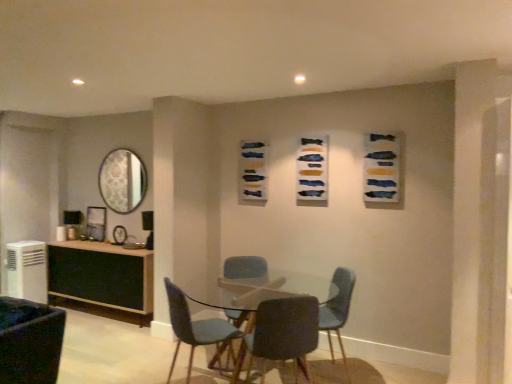
This screenshot has width=512, height=384. Describe the element at coordinates (253, 171) in the screenshot. I see `textured fabric artwork at center, which is counted as the 1th art, starting from the left` at that location.

What do you see at coordinates (122, 181) in the screenshot? Image resolution: width=512 pixels, height=384 pixels. I see `silver/metallic mirror at upper left` at bounding box center [122, 181].

This screenshot has width=512, height=384. What do you see at coordinates (27, 271) in the screenshot?
I see `white plastic air conditioner at lower left` at bounding box center [27, 271].

This screenshot has height=384, width=512. What do you see at coordinates (382, 168) in the screenshot?
I see `blue textured fabric at upper right, the first art when ordered from right to left` at bounding box center [382, 168].

Locate an element on the screen. matte gray chair at center, the 2th chair from the left is located at coordinates (196, 329).

Describe the element at coordinates (102, 277) in the screenshot. I see `matte wood desk at left` at that location.

The image size is (512, 384). I want to click on textured fabric artwork at center, which is counted as the 1th art, starting from the left, so click(253, 171).

Is matte yellow and blue abstract painting at center, the 2th art in the front-to-back sequence, not close to white plastic air conditioner at lower left?

matte yellow and blue abstract painting at center, the 2th art in the front-to-back sequence, is positioned a significant distance from white plastic air conditioner at lower left.

Between matte yellow and blue abstract painting at center, the 2th art positioned from the right, and white plastic air conditioner at lower left, which one has smaller width?

matte yellow and blue abstract painting at center, the 2th art positioned from the right.

Which of these two, matte yellow and blue abstract painting at center, the 2th art positioned from the right, or white plastic air conditioner at lower left, stands shorter?

With less height is matte yellow and blue abstract painting at center, the 2th art positioned from the right.

There is a matte wood desk at left. Identify the location of the 4th chair below it (from the image's perspective). The width and height of the screenshot is (512, 384). (282, 333).

Is matte wood desk at left inside or outside of velvet blue chair at center, placed as the fourth chair when sorted from left to right?

The correct answer is: outside.

Is point (71, 241) farther from viewer compared to point (275, 359)?

Yes.

Could you tell me if matte wood desk at left is facing velvet blue chair at center, placed as the fourth chair when sorted from left to right?

No, matte wood desk at left does not turn towards velvet blue chair at center, placed as the fourth chair when sorted from left to right.

Which of these two, white plastic air conditioner at lower left or clear glass table at center, is thinner?

white plastic air conditioner at lower left.

Considering the sizes of objects white plastic air conditioner at lower left and clear glass table at center in the image provided, who is smaller, white plastic air conditioner at lower left or clear glass table at center?

Smaller between the two is white plastic air conditioner at lower left.

From the image's perspective, which one is positioned higher, white plastic air conditioner at lower left or clear glass table at center?

white plastic air conditioner at lower left appears higher in the image.

How many degrees apart are the facing directions of clear glass table at center and blue textured fabric at upper right, the first art when ordered from right to left?

The angle between the facing direction of clear glass table at center and the facing direction of blue textured fabric at upper right, the first art when ordered from right to left, is 0.559 degrees.

In the scene shown: Considering the positions of objects clear glass table at center and blue textured fabric at upper right, which is the first art in front-to-back order, in the image provided, who is more to the right, clear glass table at center or blue textured fabric at upper right, which is the first art in front-to-back order,?

From the viewer's perspective, blue textured fabric at upper right, which is the first art in front-to-back order, appears more on the right side.

Locate an element on the screen. kitchen & dining room table on the left of blue textured fabric at upper right, which appears as the 3th art when viewed from the left is located at coordinates (282, 297).

In the scene shown: Would you say clear glass table at center is inside or outside blue textured fabric at upper right, which appears as the 3th art when viewed from the left?

clear glass table at center exists outside the volume of blue textured fabric at upper right, which appears as the 3th art when viewed from the left.

Looking at this image, is matte yellow and blue abstract painting at center, the 2th art positioned from the right, smaller than clear glass table at center?

Correct, matte yellow and blue abstract painting at center, the 2th art positioned from the right, occupies less space than clear glass table at center.

From the image's perspective, is matte yellow and blue abstract painting at center, the 2th art positioned from the right, under clear glass table at center?

No.

Is matte yellow and blue abstract painting at center, the second art in the left-to-right sequence, completely or partially outside of clear glass table at center?

Indeed, matte yellow and blue abstract painting at center, the second art in the left-to-right sequence, is completely outside clear glass table at center.

Consider the image. Can you tell me how much matte yellow and blue abstract painting at center, the 2th art in the front-to-back sequence, and clear glass table at center differ in facing direction?

The facing directions of matte yellow and blue abstract painting at center, the 2th art in the front-to-back sequence, and clear glass table at center are 0.549 degrees apart.

Between matte blue chair at center, the third chair from the left, and clear glass table at center, which one has larger size?

clear glass table at center is bigger.

Is matte blue chair at center, the third chair from the left, situated inside clear glass table at center or outside?

matte blue chair at center, the third chair from the left, exists entirely within clear glass table at center.

Consider the image. Does matte blue chair at center, the third chair from the left, have a greater height compared to clear glass table at center?

Indeed, matte blue chair at center, the third chair from the left, has a greater height compared to clear glass table at center.

How far apart are clear glass table at center and velvet blue chair at center, which is counted as the 2th chair, starting from the right?

The distance of clear glass table at center from velvet blue chair at center, which is counted as the 2th chair, starting from the right, is 82.00 centimeters.

Does clear glass table at center have a lesser height compared to velvet blue chair at center, which is counted as the 2th chair, starting from the right?

Correct, clear glass table at center is not as tall as velvet blue chair at center, which is counted as the 2th chair, starting from the right.

How different are the orientations of clear glass table at center and velvet blue chair at center, placed as the fourth chair when sorted from left to right, in degrees?

They differ by 141 degrees in their facing directions.

From a real-world perspective, is clear glass table at center physically below velvet blue chair at center, placed as the fourth chair when sorted from left to right?

Yes, from a real-world perspective, clear glass table at center is below velvet blue chair at center, placed as the fourth chair when sorted from left to right.

Identify the location of appliance behind the matte yellow and blue abstract painting at center, marked as the second art in a back-to-front arrangement. (27, 271).

Where is `the 4th chair in front of the matte wood desk at left`? the 4th chair in front of the matte wood desk at left is located at coordinates (282, 333).

From the image, which object appears to be farther from matte gray chair at center, placed as the fourth chair when sorted from right to left, matte wood desk at left or textured fabric artwork at center, which is counted as the 1th art, starting from the left?

matte wood desk at left lies further to matte gray chair at center, placed as the fourth chair when sorted from right to left, than the other object.

Looking at the image, which one is located further to velvet blue chair at center, which is counted as the 2th chair, starting from the right, matte gray chair at center, placed as the fourth chair when sorted from right to left, or clear glass table at center?

Among the two, clear glass table at center is located further to velvet blue chair at center, which is counted as the 2th chair, starting from the right.

Which object lies further to the anchor point silver/metallic mirror at upper left, velvet blue chair at center, which is counted as the 2th chair, starting from the right, or velvet dark blue chair at lower left, acting as the first chair starting from the left?

velvet blue chair at center, which is counted as the 2th chair, starting from the right, lies further to silver/metallic mirror at upper left than the other object.

When comparing their distances from matte blue chair at center, the third chair from the left, does matte wood desk at left or textured fabric artwork at center, which is counted as the 1th art, starting from the left, seem closer?

textured fabric artwork at center, which is counted as the 1th art, starting from the left.

Which object lies further to the anchor point silver/metallic mirror at upper left, matte wood desk at left or matte gray chair at center, placed as the fourth chair when sorted from right to left?

matte gray chair at center, placed as the fourth chair when sorted from right to left, is positioned further to the anchor silver/metallic mirror at upper left.

From the picture: When comparing their distances from matte gray chair at center, placed as the fourth chair when sorted from right to left, does matte yellow and blue abstract painting at center, the 2th art in the front-to-back sequence, or textured fabric artwork at center, which is counted as the 1th art, starting from the left, seem further?

matte yellow and blue abstract painting at center, the 2th art in the front-to-back sequence.

When comparing their distances from matte blue chair at center, which is the third chair from right to left, does matte yellow and blue abstract painting at center, the 2th art positioned from the right, or clear glass table at center seem further?

Based on the image, matte yellow and blue abstract painting at center, the 2th art positioned from the right, appears to be further to matte blue chair at center, which is the third chair from right to left.

From the image, which object appears to be nearer to velvet dark blue chair at lower left, acting as the first chair starting from the left, white plastic air conditioner at lower left or matte yellow and blue abstract painting at center, marked as the second art in a back-to-front arrangement?

white plastic air conditioner at lower left is closer to velvet dark blue chair at lower left, acting as the first chair starting from the left.

Locate an element on the screen. Image resolution: width=512 pixels, height=384 pixels. art situated between white plastic air conditioner at lower left and clear glass table at center from left to right is located at coordinates (253, 171).

The width and height of the screenshot is (512, 384). Identify the location of kitchen & dining room table between matte wood desk at left and matte blue chair at center, the 1th chair viewed from the right. (282, 297).

This screenshot has width=512, height=384. What are the coordinates of `mirror between white plastic air conditioner at lower left and matte blue chair at center, marked as the fifth chair in a left-to-right arrangement, in the horizontal direction` in the screenshot? It's located at (122, 181).

Locate an element on the screen. The height and width of the screenshot is (384, 512). art between matte yellow and blue abstract painting at center, marked as the second art in a back-to-front arrangement, and clear glass table at center from top to bottom is located at coordinates (382, 168).